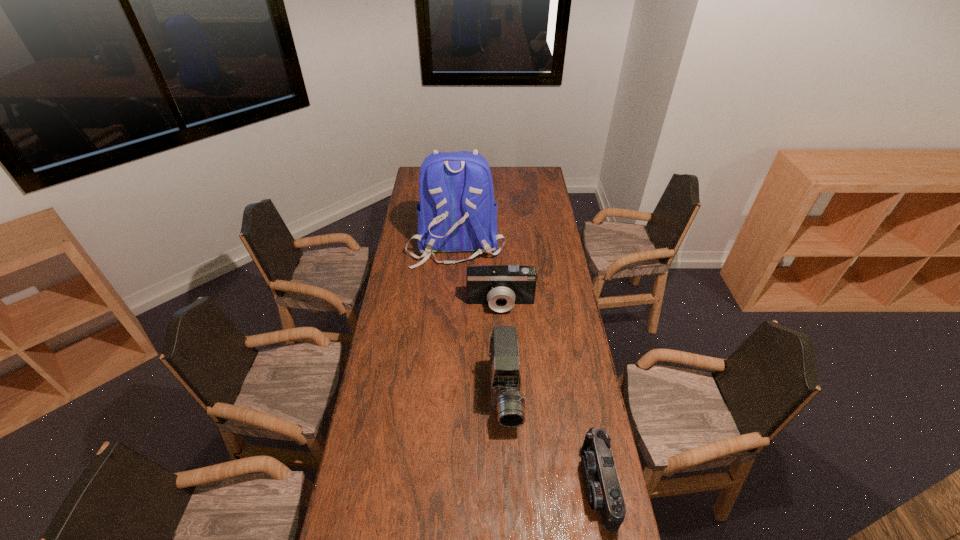
Find the location of `the farthest object`. the farthest object is located at coordinates (457, 212).

The width and height of the screenshot is (960, 540). I want to click on the tallest object, so click(x=457, y=212).

Locate an element on the screen. the second nearest camcorder is located at coordinates (506, 399).

Image resolution: width=960 pixels, height=540 pixels. What are the coordinates of `the third shortest object` in the screenshot? It's located at coord(506,399).

Identify the location of the second shortest camcorder. The width and height of the screenshot is (960, 540). (501, 286).

The width and height of the screenshot is (960, 540). I want to click on the second farthest object, so click(501, 286).

Find the location of a particular element. Image resolution: width=960 pixels, height=540 pixels. the rightmost object is located at coordinates (603, 490).

In order to click on the rightmost camcorder in this screenshot , I will do `click(603, 490)`.

Locate an element on the screen. The width and height of the screenshot is (960, 540). free space located 0.230m on the back of the backpack is located at coordinates (452, 306).

Where is `free spot located 0.270m at the front of the second farthest camcorder, highlighting the lens`? This screenshot has height=540, width=960. free spot located 0.270m at the front of the second farthest camcorder, highlighting the lens is located at coordinates (511, 525).